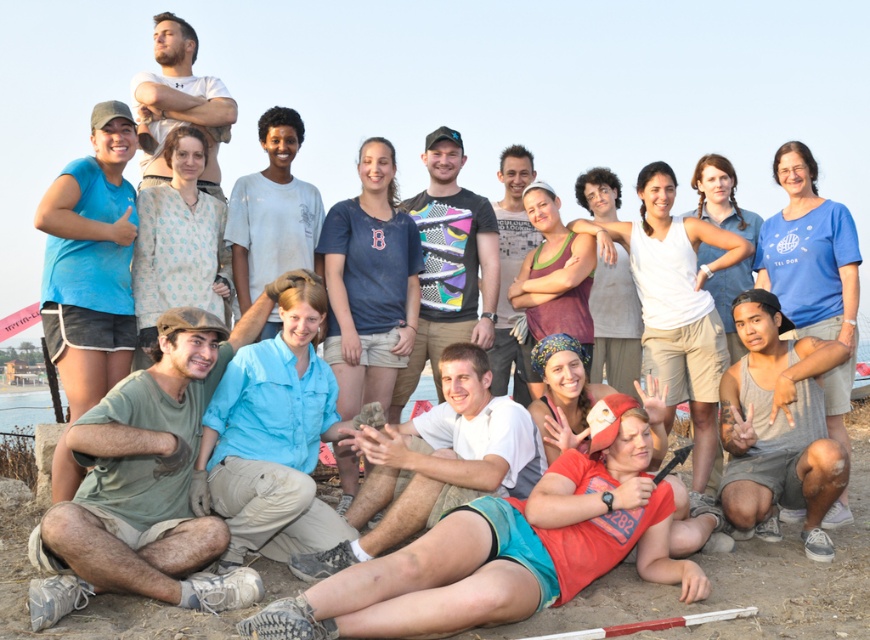
Question: Which object is the closest to the gray tank top at lower right?

Choices:
 (A) green cotton shirt at lower left
 (B) matte blue shirt at center
 (C) light brown textured shirt at center
 (D) multicolored jersey at center

Answer: (C)

Question: Can you confirm if green cotton shirt at lower left is wider than light blue shirt at center?

Choices:
 (A) no
 (B) yes

Answer: (A)

Question: Estimate the real-world distances between objects in this image. Which object is farther from the light brown textured shirt at center?

Choices:
 (A) matte blue shirt at center
 (B) multicolored jersey at center
 (C) matte blue shirt at left

Answer: (C)

Question: Does multicolored jersey at center appear under light brown textured shirt at center?

Choices:
 (A) no
 (B) yes

Answer: (B)

Question: Estimate the real-world distances between objects in this image. Which object is farther from the light blue shirt at center?

Choices:
 (A) gray tank top at lower right
 (B) matte blue shirt at left
 (C) light brown textured shirt at center

Answer: (B)

Question: Can you confirm if matte blue shirt at center is positioned above light brown textured shirt at center?

Choices:
 (A) no
 (B) yes

Answer: (B)